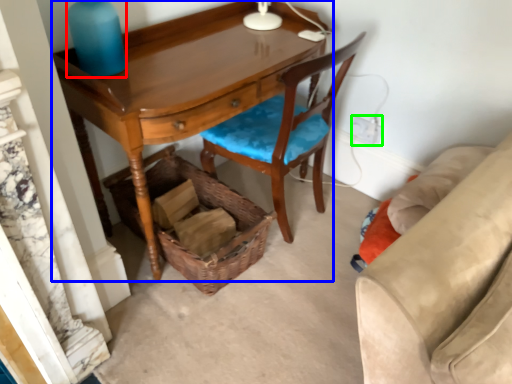
Question: Considering the real-world distances, which object is closest to bottle (highlighted by a red box)? desk (highlighted by a blue box) or power outlet (highlighted by a green box).

Choices:
 (A) desk
 (B) power outlet

Answer: (A)